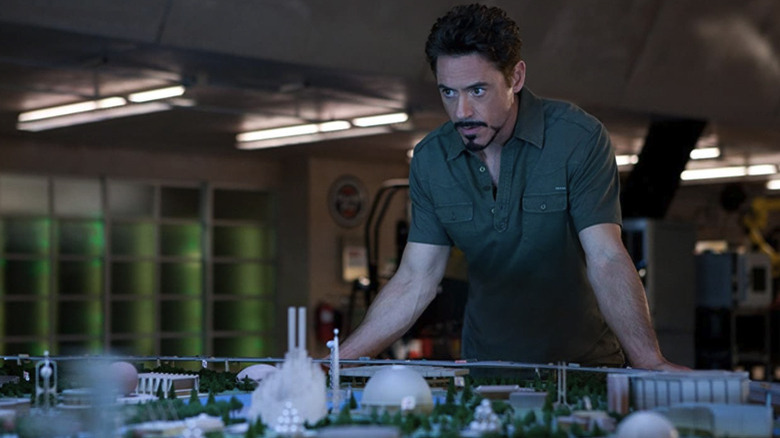
Identify the location of metal railing around display on table. Image resolution: width=780 pixels, height=438 pixels. (486, 366), (266, 361), (144, 357).